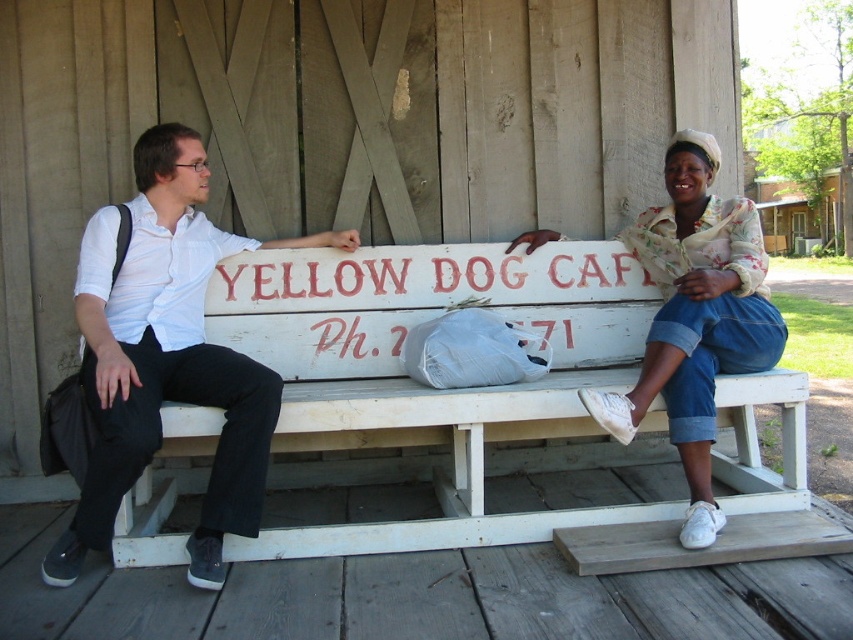
Who is lower down, white wooden bench at center or white cotton shirt at left?

white wooden bench at center

In the scene shown: Between white wooden bench at center and white cotton shirt at left, which one appears on the left side from the viewer's perspective?

Positioned to the left is white cotton shirt at left.

Identify the location of white wooden bench at center. (428, 388).

The width and height of the screenshot is (853, 640). I want to click on white wooden bench at center, so click(x=428, y=388).

Can you confirm if white cotton shirt at left is positioned to the left of denim skirt at right?

Yes, white cotton shirt at left is to the left of denim skirt at right.

Locate an element on the screen. white cotton shirt at left is located at coordinates (167, 356).

Between point (500, 257) and point (711, 326), which one is positioned behind?

Point (500, 257)

From the picture: Can you confirm if white wooden bench at center is taller than denim skirt at right?

In fact, white wooden bench at center may be shorter than denim skirt at right.

Is point (468, 252) behind point (730, 230)?

Yes.

Identify the location of white wooden bench at center. (428, 388).